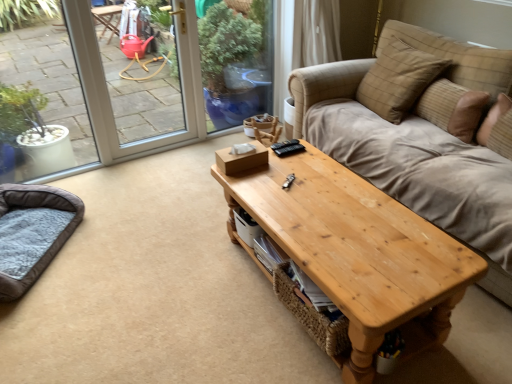
Consider the image. What is the approximate height of natural wood coffee table at center?

natural wood coffee table at center is 49.09 centimeters in height.

The width and height of the screenshot is (512, 384). Describe the element at coordinates (358, 252) in the screenshot. I see `natural wood coffee table at center` at that location.

The width and height of the screenshot is (512, 384). Describe the element at coordinates (453, 108) in the screenshot. I see `brown textured pillow at upper right, which is the 2th pillow in left-to-right order` at that location.

Locate an element on the screen. The image size is (512, 384). natural wood coffee table at center is located at coordinates (358, 252).

Who is more distant, natural wood coffee table at center or brown textured pillow at upper right, the first pillow from the right?

brown textured pillow at upper right, the first pillow from the right, is behind.

Can you confirm if natural wood coffee table at center is positioned to the right of brown textured pillow at upper right, which is the 2th pillow in left-to-right order?

No, natural wood coffee table at center is not to the right of brown textured pillow at upper right, which is the 2th pillow in left-to-right order.

From the image's perspective, does natural wood coffee table at center appear lower than brown textured pillow at upper right, which is the 2th pillow in left-to-right order?

Indeed, from the image's perspective, natural wood coffee table at center is shown beneath brown textured pillow at upper right, which is the 2th pillow in left-to-right order.

What's the angular difference between natural wood coffee table at center and brown textured pillow at upper right, the first pillow from the right,'s facing directions?

They differ by 9.07 degrees in their facing directions.

Is brown textured pillow at upper right, which is the 2th pillow in left-to-right order, looking in the opposite direction of dark brown plush cat bed at lower left?

No, brown textured pillow at upper right, which is the 2th pillow in left-to-right order, is not facing away from dark brown plush cat bed at lower left.

From the image's perspective, between brown textured pillow at upper right, the first pillow from the right, and dark brown plush cat bed at lower left, who is located below?

dark brown plush cat bed at lower left is shown below in the image.

From their relative heights in the image, would you say brown textured pillow at upper right, the first pillow from the right, is taller or shorter than dark brown plush cat bed at lower left?

Considering their sizes, brown textured pillow at upper right, the first pillow from the right, has more height than dark brown plush cat bed at lower left.

Between brown textured pillow at upper right, which is the 2th pillow in left-to-right order, and dark brown plush cat bed at lower left, which one appears on the left side from the viewer's perspective?

dark brown plush cat bed at lower left.

Does point (380, 66) come behind point (449, 100)?

That is True.

In order to click on pillow behind the brown textured pillow at upper right, which is the 2th pillow in left-to-right order in this screenshot , I will do `click(398, 80)`.

Between plaid fabric pillow at upper right, the second pillow from the right, and brown textured pillow at upper right, which is the 2th pillow in left-to-right order, which one has more height?

Standing taller between the two is plaid fabric pillow at upper right, the second pillow from the right.

Which object is further away from the camera, plaid fabric pillow at upper right, which is the first pillow in left-to-right order, or brown textured pillow at upper right, the first pillow from the right?

plaid fabric pillow at upper right, which is the first pillow in left-to-right order, is more distant.

You are a GUI agent. You are given a task and a screenshot of the screen. Output one action in this format:
    pyautogui.click(x=<x>, y=<y>)
    Task: Click on the coffee table on the right of dark brown plush cat bed at lower left
    This screenshot has width=512, height=384.
    Given the screenshot: What is the action you would take?
    pyautogui.click(x=358, y=252)

Does point (367, 327) lie behind point (42, 198)?

No, (367, 327) is closer to viewer.

Is natural wood coffee table at center completely or partially outside of dark brown plush cat bed at lower left?

Absolutely, natural wood coffee table at center is external to dark brown plush cat bed at lower left.

How different are the orientations of natural wood coffee table at center and dark brown plush cat bed at lower left in degrees?

The angular difference between natural wood coffee table at center and dark brown plush cat bed at lower left is 143 degrees.

Is point (405, 224) closer to viewer compared to point (364, 91)?

Yes, point (405, 224) is in front of point (364, 91).

Consider the image. Between natural wood coffee table at center and plaid fabric pillow at upper right, which is the first pillow in left-to-right order, which one has larger width?

natural wood coffee table at center is wider.

Based on the photo, choose the correct answer: Is natural wood coffee table at center inside plaid fabric pillow at upper right, the second pillow from the right, or outside it?

natural wood coffee table at center is outside plaid fabric pillow at upper right, the second pillow from the right.

Is natural wood coffee table at center to the left of plaid fabric pillow at upper right, which is the first pillow in left-to-right order, from the viewer's perspective?

Yes, natural wood coffee table at center is to the left of plaid fabric pillow at upper right, which is the first pillow in left-to-right order.

Is dark brown plush cat bed at lower left aimed at brown textured pillow at upper right, which is the 2th pillow in left-to-right order?

No, dark brown plush cat bed at lower left is not facing towards brown textured pillow at upper right, which is the 2th pillow in left-to-right order.

The image size is (512, 384). Find the location of `the 1st pillow above the dark brown plush cat bed at lower left (from the image's perspective)`. the 1st pillow above the dark brown plush cat bed at lower left (from the image's perspective) is located at coordinates (453, 108).

Does dark brown plush cat bed at lower left come in front of brown textured pillow at upper right, which is the 2th pillow in left-to-right order?

Yes, dark brown plush cat bed at lower left is closer to the viewer.

Is dark brown plush cat bed at lower left surrounding natural wood coffee table at center?

No, dark brown plush cat bed at lower left does not contain natural wood coffee table at center.

Between dark brown plush cat bed at lower left and natural wood coffee table at center, which one has less height?

dark brown plush cat bed at lower left.

Is point (2, 189) closer to viewer compared to point (322, 153)?

No, (2, 189) is behind (322, 153).

Where is `coffee table located in front of the brown textured pillow at upper right, which is the 2th pillow in left-to-right order`? coffee table located in front of the brown textured pillow at upper right, which is the 2th pillow in left-to-right order is located at coordinates (358, 252).

Identify the location of cat bed below the brown textured pillow at upper right, which is the 2th pillow in left-to-right order (from a real-world perspective). This screenshot has height=384, width=512. (32, 232).

Looking at the image, which one is located further to natural wood coffee table at center, brown textured pillow at upper right, which is the 2th pillow in left-to-right order, or plaid fabric pillow at upper right, which is the first pillow in left-to-right order?

The object further to natural wood coffee table at center is plaid fabric pillow at upper right, which is the first pillow in left-to-right order.

From the image, which object appears to be farther from brown textured pillow at upper right, which is the 2th pillow in left-to-right order, natural wood coffee table at center or dark brown plush cat bed at lower left?

dark brown plush cat bed at lower left lies further to brown textured pillow at upper right, which is the 2th pillow in left-to-right order, than the other object.

Based on the photo, based on their spatial positions, is dark brown plush cat bed at lower left or brown textured pillow at upper right, which is the 2th pillow in left-to-right order, closer to natural wood coffee table at center?

brown textured pillow at upper right, which is the 2th pillow in left-to-right order.

Based on their spatial positions, is plaid fabric pillow at upper right, the second pillow from the right, or natural wood coffee table at center further from dark brown plush cat bed at lower left?

Among the two, plaid fabric pillow at upper right, the second pillow from the right, is located further to dark brown plush cat bed at lower left.

Which object lies nearer to the anchor point dark brown plush cat bed at lower left, brown textured pillow at upper right, the first pillow from the right, or plaid fabric pillow at upper right, which is the first pillow in left-to-right order?

plaid fabric pillow at upper right, which is the first pillow in left-to-right order.

From the image, which object appears to be nearer to plaid fabric pillow at upper right, which is the first pillow in left-to-right order, dark brown plush cat bed at lower left or natural wood coffee table at center?

natural wood coffee table at center lies closer to plaid fabric pillow at upper right, which is the first pillow in left-to-right order, than the other object.

Based on their spatial positions, is dark brown plush cat bed at lower left or plaid fabric pillow at upper right, which is the first pillow in left-to-right order, further from brown textured pillow at upper right, the first pillow from the right?

dark brown plush cat bed at lower left.

From the picture: Based on their spatial positions, is dark brown plush cat bed at lower left or brown textured pillow at upper right, which is the 2th pillow in left-to-right order, closer to plaid fabric pillow at upper right, the second pillow from the right?

brown textured pillow at upper right, which is the 2th pillow in left-to-right order.

At what (x,y) coordinates should I click in order to perform the action: click on pillow between dark brown plush cat bed at lower left and brown textured pillow at upper right, the first pillow from the right, in the horizontal direction. Please return your answer as a coordinate pair (x, y). This screenshot has height=384, width=512. Looking at the image, I should click on (398, 80).

You are a GUI agent. You are given a task and a screenshot of the screen. Output one action in this format:
    pyautogui.click(x=<x>, y=<y>)
    Task: Click on the coffee table between dark brown plush cat bed at lower left and plaid fabric pillow at upper right, the second pillow from the right, in the horizontal direction
    
    Given the screenshot: What is the action you would take?
    pyautogui.click(x=358, y=252)

Identify the location of pillow located between natural wood coffee table at center and plaid fabric pillow at upper right, which is the first pillow in left-to-right order, in the depth direction. The image size is (512, 384). 453,108.

At what (x,y) coordinates should I click in order to perform the action: click on coffee table situated between dark brown plush cat bed at lower left and brown textured pillow at upper right, the first pillow from the right, from left to right. Please return your answer as a coordinate pair (x, y). The image size is (512, 384). Looking at the image, I should click on (358, 252).